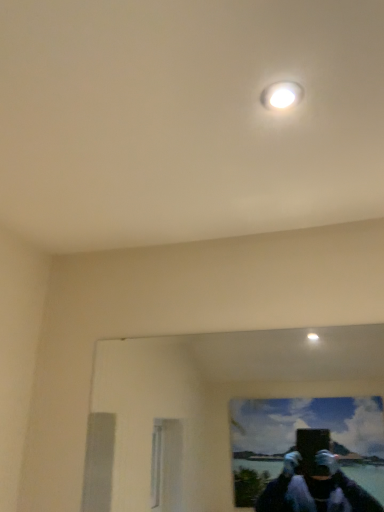
The height and width of the screenshot is (512, 384). Describe the element at coordinates (281, 95) in the screenshot. I see `white glossy light fixture at upper center` at that location.

Where is `white glossy light fixture at upper center`? Image resolution: width=384 pixels, height=512 pixels. white glossy light fixture at upper center is located at coordinates (281, 95).

Measure the distance between white glossy light fixture at upper center and camera.

white glossy light fixture at upper center is 33.43 inches away from camera.

Locate an element on the screen. white glossy light fixture at upper center is located at coordinates (281, 95).